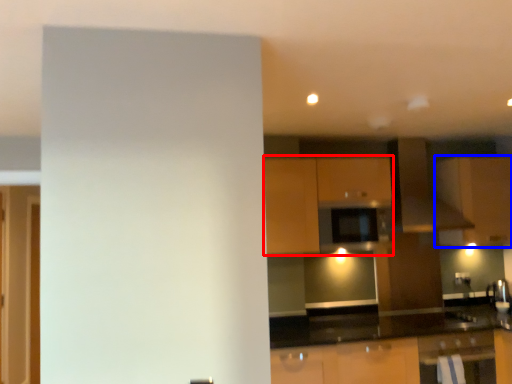
Question: Among these objects, which one is nearest to the camera, cabinetry (highlighted by a red box) or cabinetry (highlighted by a blue box)?

Choices:
 (A) cabinetry
 (B) cabinetry

Answer: (A)